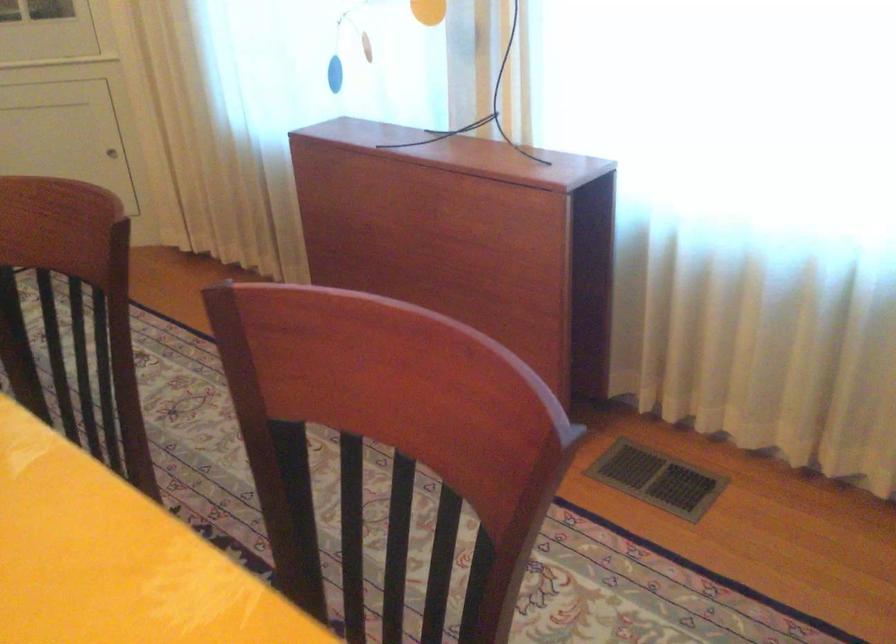
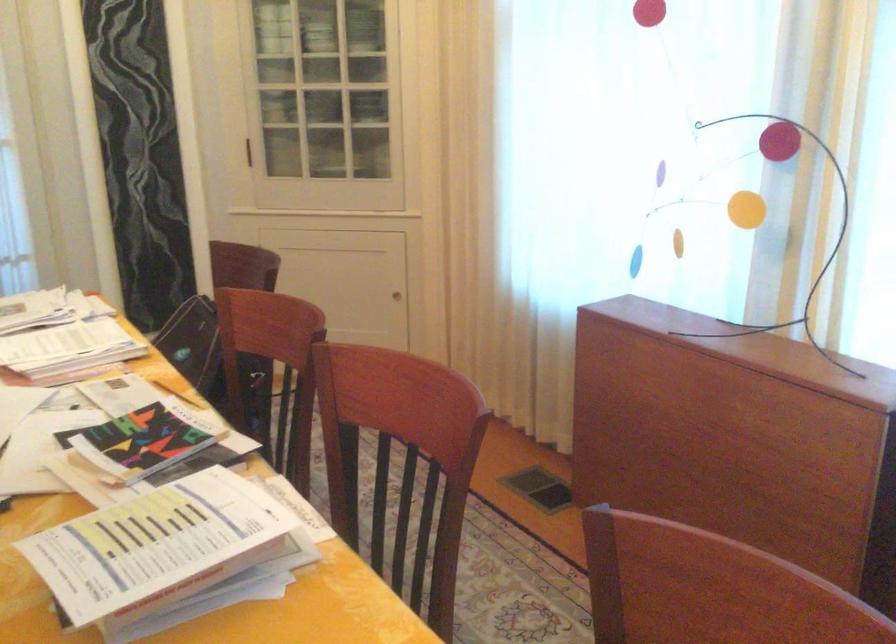
The point at (108, 149) is marked in the first image. Where is the corresponding point in the second image?

(395, 295)